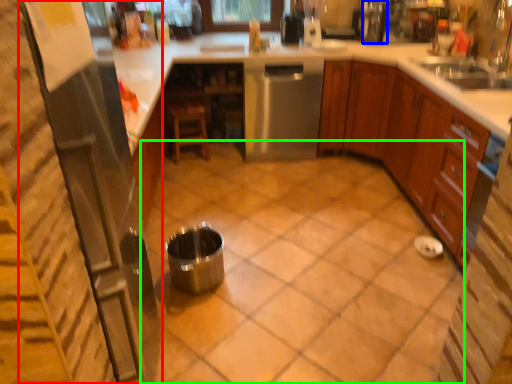
Question: Considering the real-world distances, which object is farthest from appliance (highlighted by a red box)? appliance (highlighted by a blue box) or tile (highlighted by a green box)?

Choices:
 (A) appliance
 (B) tile

Answer: (A)